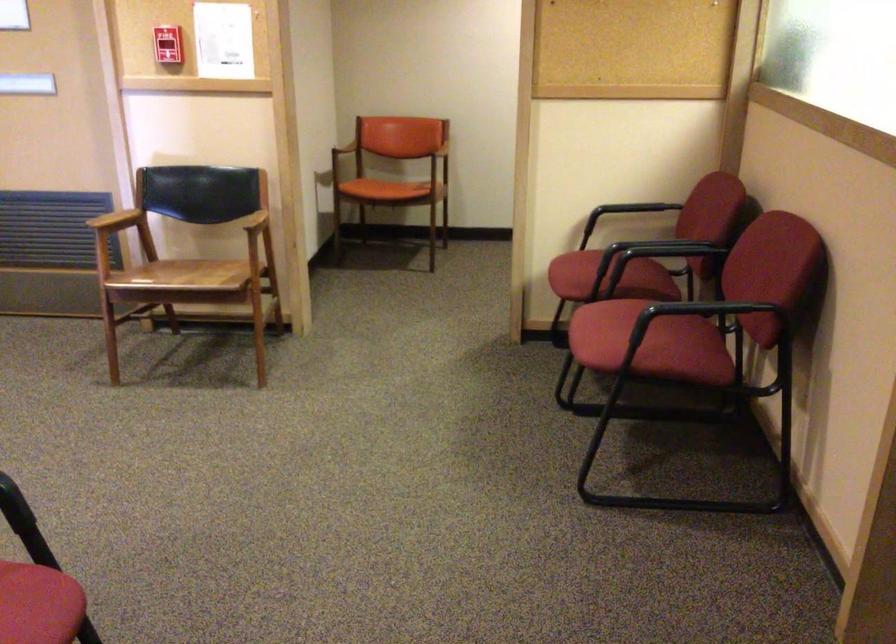
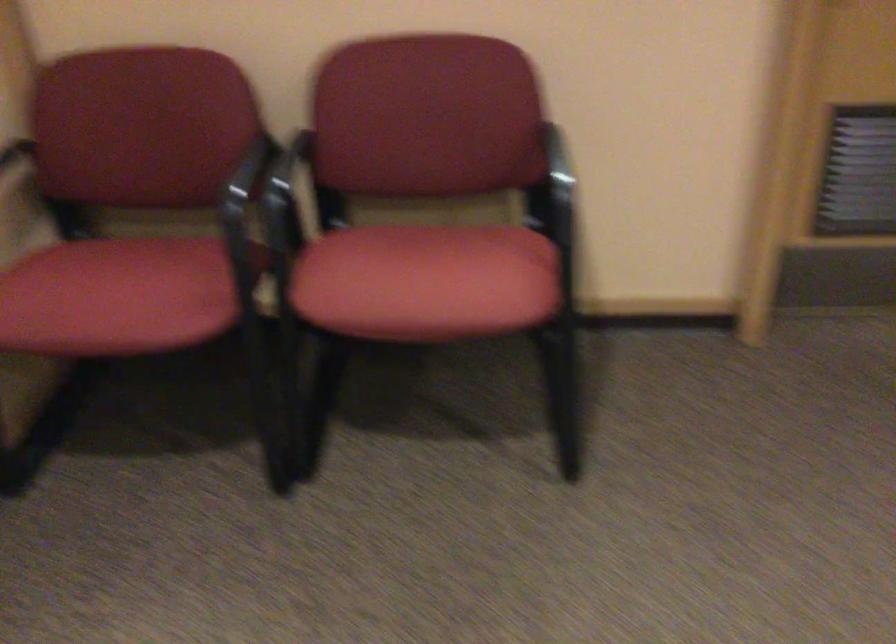
Find the pixel in the second image that matches (604,330) in the first image.

(426, 281)